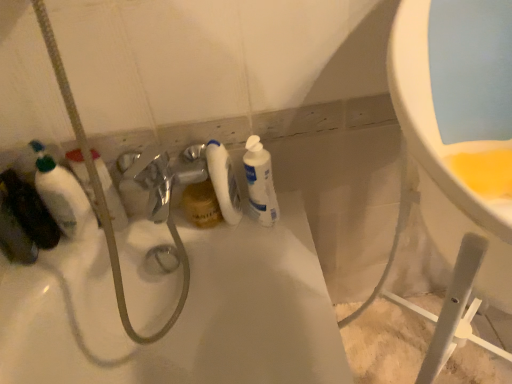
This screenshot has width=512, height=384. What do you see at coordinates (260, 182) in the screenshot?
I see `white glossy bottle at center, which ranks as the second cleaning product in left-to-right order` at bounding box center [260, 182].

How much space does white glossy bottle at center, which appears as the 1th cleaning product when viewed from the right, occupy vertically?

8.51 inches.

Find the location of a particular element. Image resolution: width=512 pixels, height=384 pixels. white glossy bottle at center, which appears as the 1th cleaning product when viewed from the right is located at coordinates (260, 182).

This screenshot has height=384, width=512. Describe the element at coordinates (223, 181) in the screenshot. I see `white matte bottle at center, the first cleaning product when ordered from left to right` at that location.

This screenshot has height=384, width=512. I want to click on white matte bottle at center, the first cleaning product when ordered from left to right, so click(x=223, y=181).

What is the approximate height of white matte bottle at center, the first cleaning product when ordered from left to right?

white matte bottle at center, the first cleaning product when ordered from left to right, is 9.28 inches tall.

Where is `white glossy bottle at center, which appears as the 1th cleaning product when viewed from the right`? white glossy bottle at center, which appears as the 1th cleaning product when viewed from the right is located at coordinates (260, 182).

Is white matte bottle at center, the first cleaning product when ordered from left to right, to the right of white glossy bottle at center, which ranks as the second cleaning product in left-to-right order, from the viewer's perspective?

In fact, white matte bottle at center, the first cleaning product when ordered from left to right, is to the left of white glossy bottle at center, which ranks as the second cleaning product in left-to-right order.

Which object is further away from the camera, white matte bottle at center, the 2th cleaning product from the right, or white glossy bottle at center, which ranks as the second cleaning product in left-to-right order?

white matte bottle at center, the 2th cleaning product from the right, is further away from the camera.

Considering the points (219, 143) and (257, 163), which point is in front, point (219, 143) or point (257, 163)?

Positioned in front is point (257, 163).

From the image's perspective, is white matte bottle at center, the first cleaning product when ordered from left to right, on white glossy bottle at center, which ranks as the second cleaning product in left-to-right order?

Yes.

In the scene shown: From a real-world perspective, who is located higher, white matte bottle at center, the first cleaning product when ordered from left to right, or white glossy bottle at center, which appears as the 1th cleaning product when viewed from the right?

white matte bottle at center, the first cleaning product when ordered from left to right, from a real-world perspective.

Between white matte bottle at center, the 2th cleaning product from the right, and white glossy bottle at center, which appears as the 1th cleaning product when viewed from the right, which one has smaller width?

white matte bottle at center, the 2th cleaning product from the right.

Which of these two, white matte bottle at center, the first cleaning product when ordered from left to right, or white glossy bottle at center, which ranks as the second cleaning product in left-to-right order, stands shorter?

white glossy bottle at center, which ranks as the second cleaning product in left-to-right order, is shorter.

Who is bigger, white matte bottle at center, the 2th cleaning product from the right, or white glossy bottle at center, which ranks as the second cleaning product in left-to-right order?

Bigger between the two is white glossy bottle at center, which ranks as the second cleaning product in left-to-right order.

From the picture: Is white matte bottle at center, the first cleaning product when ordered from left to right, located outside white glossy bottle at center, which appears as the 1th cleaning product when viewed from the right?

Yes.

Would you consider white matte bottle at center, the first cleaning product when ordered from left to right, to be distant from white glossy bottle at center, which ranks as the second cleaning product in left-to-right order?

That's not correct — white matte bottle at center, the first cleaning product when ordered from left to right, is a little close to white glossy bottle at center, which ranks as the second cleaning product in left-to-right order.

Is white matte bottle at center, the 2th cleaning product from the right, aimed at white glossy bottle at center, which ranks as the second cleaning product in left-to-right order?

No, white matte bottle at center, the 2th cleaning product from the right, does not turn towards white glossy bottle at center, which ranks as the second cleaning product in left-to-right order.

Can you tell me how much white matte bottle at center, the 2th cleaning product from the right, and white glossy bottle at center, which ranks as the second cleaning product in left-to-right order, differ in facing direction?

The angle between the facing direction of white matte bottle at center, the 2th cleaning product from the right, and the facing direction of white glossy bottle at center, which ranks as the second cleaning product in left-to-right order, is 0.00379 degrees.

Could you measure the distance between white matte bottle at center, the 2th cleaning product from the right, and white glossy bottle at center, which ranks as the second cleaning product in left-to-right order?

A distance of 2.43 inches exists between white matte bottle at center, the 2th cleaning product from the right, and white glossy bottle at center, which ranks as the second cleaning product in left-to-right order.

Locate an element on the screen. cleaning product on the right of the white matte bottle at center, the 2th cleaning product from the right is located at coordinates (260, 182).

Considering the relative positions of white glossy bottle at center, which ranks as the second cleaning product in left-to-right order, and white matte bottle at center, the 2th cleaning product from the right, in the image provided, is white glossy bottle at center, which ranks as the second cleaning product in left-to-right order, to the right of white matte bottle at center, the 2th cleaning product from the right, from the viewer's perspective?

Yes, white glossy bottle at center, which ranks as the second cleaning product in left-to-right order, is to the right of white matte bottle at center, the 2th cleaning product from the right.

Between white glossy bottle at center, which appears as the 1th cleaning product when viewed from the right, and white matte bottle at center, the first cleaning product when ordered from left to right, which one is positioned in front?

Positioned in front is white glossy bottle at center, which appears as the 1th cleaning product when viewed from the right.

Does point (257, 185) appear closer or farther from the camera than point (226, 217)?

Point (257, 185) is positioned closer to the camera compared to point (226, 217).

From the image's perspective, which is above, white glossy bottle at center, which appears as the 1th cleaning product when viewed from the right, or white matte bottle at center, the 2th cleaning product from the right?

From the image's view, white matte bottle at center, the 2th cleaning product from the right, is above.

From a real-world perspective, is white glossy bottle at center, which appears as the 1th cleaning product when viewed from the right, below white matte bottle at center, the 2th cleaning product from the right?

Yes, from a real-world perspective, white glossy bottle at center, which appears as the 1th cleaning product when viewed from the right, is below white matte bottle at center, the 2th cleaning product from the right.

Considering the relative sizes of white glossy bottle at center, which appears as the 1th cleaning product when viewed from the right, and white matte bottle at center, the first cleaning product when ordered from left to right, in the image provided, is white glossy bottle at center, which appears as the 1th cleaning product when viewed from the right, wider than white matte bottle at center, the first cleaning product when ordered from left to right,?

Indeed, white glossy bottle at center, which appears as the 1th cleaning product when viewed from the right, has a greater width compared to white matte bottle at center, the first cleaning product when ordered from left to right.

Can you confirm if white glossy bottle at center, which appears as the 1th cleaning product when viewed from the right, is shorter than white matte bottle at center, the 2th cleaning product from the right?

Correct, white glossy bottle at center, which appears as the 1th cleaning product when viewed from the right, is not as tall as white matte bottle at center, the 2th cleaning product from the right.

Between white glossy bottle at center, which appears as the 1th cleaning product when viewed from the right, and white matte bottle at center, the first cleaning product when ordered from left to right, which one has smaller size?

white matte bottle at center, the first cleaning product when ordered from left to right.

Is white matte bottle at center, the first cleaning product when ordered from left to right, surrounded by white glossy bottle at center, which appears as the 1th cleaning product when viewed from the right?

No, white matte bottle at center, the first cleaning product when ordered from left to right, is not a part of white glossy bottle at center, which appears as the 1th cleaning product when viewed from the right.

Is white glossy bottle at center, which ranks as the second cleaning product in left-to-right order, oriented towards white matte bottle at center, the 2th cleaning product from the right?

No, white glossy bottle at center, which ranks as the second cleaning product in left-to-right order, is not turned towards white matte bottle at center, the 2th cleaning product from the right.

How far apart are white glossy bottle at center, which appears as the 1th cleaning product when viewed from the right, and white matte bottle at center, the 2th cleaning product from the right?

white glossy bottle at center, which appears as the 1th cleaning product when viewed from the right, and white matte bottle at center, the 2th cleaning product from the right, are 6.18 centimeters apart from each other.

I want to click on cleaning product lying below the white matte bottle at center, the first cleaning product when ordered from left to right (from the image's perspective), so click(260, 182).

In the image, there is a white glossy bottle at center, which ranks as the second cleaning product in left-to-right order. Identify the location of cleaning product above it (from the image's perspective). Image resolution: width=512 pixels, height=384 pixels. [x=223, y=181].

The width and height of the screenshot is (512, 384). Identify the location of cleaning product on the right side of white matte bottle at center, the 2th cleaning product from the right. (260, 182).